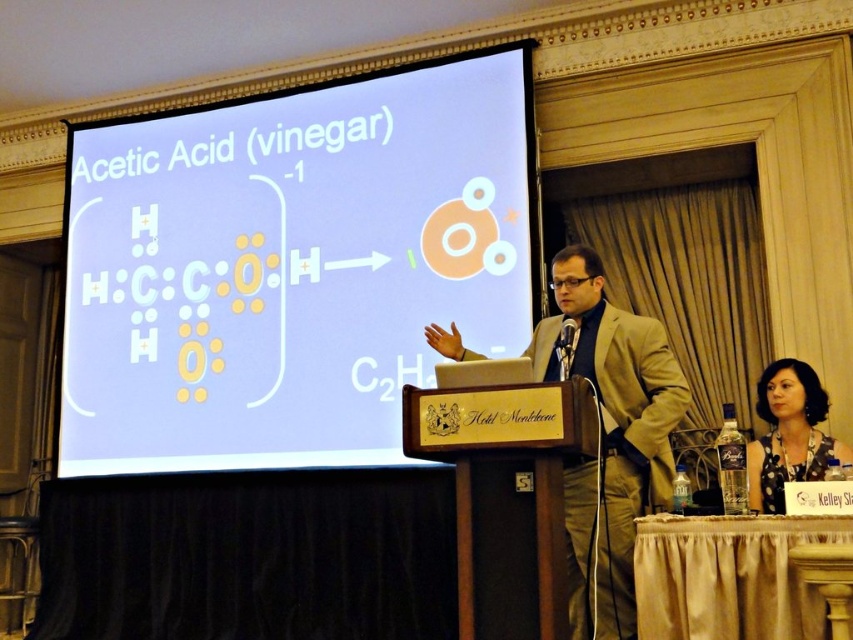
Is white glossy projection screen at center bigger than beige suit at center?

Correct, white glossy projection screen at center is larger in size than beige suit at center.

Between white glossy projection screen at center and beige suit at center, which one appears on the right side from the viewer's perspective?

From the viewer's perspective, beige suit at center appears more on the right side.

Is point (114, 228) less distant than point (579, 323)?

No, (114, 228) is behind (579, 323).

Where is `white glossy projection screen at center`? white glossy projection screen at center is located at coordinates (289, 266).

Who is shorter, white glossy projection screen at center or dark gray fabric at lower right?

dark gray fabric at lower right is shorter.

Is point (103, 204) closer to viewer compared to point (776, 461)?

No, (103, 204) is behind (776, 461).

This screenshot has width=853, height=640. Identify the location of white glossy projection screen at center. (289, 266).

Is beige suit at center taller than dark gray fabric at lower right?

Yes, beige suit at center is taller than dark gray fabric at lower right.

Who is positioned more to the left, beige suit at center or dark gray fabric at lower right?

Positioned to the left is beige suit at center.

Who is more forward, (x=654, y=396) or (x=814, y=442)?

Point (x=654, y=396) is in front.

Where is `beige suit at center`? beige suit at center is located at coordinates (610, 436).